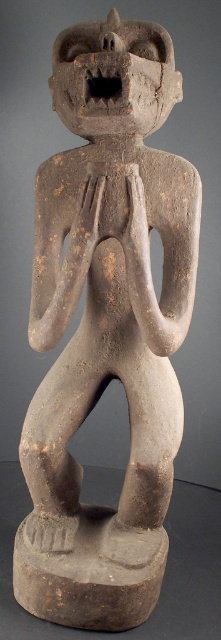
Question: Which point is closer to the camera?

Choices:
 (A) brown clay hands at center
 (B) brown clay hand at center

Answer: (A)

Question: Does brown clay hand at center have a greater width compared to brown clay hands at center?

Choices:
 (A) yes
 (B) no

Answer: (A)

Question: Considering the relative positions of brown clay hand at center and brown clay hands at center in the image provided, where is brown clay hand at center located with respect to brown clay hands at center?

Choices:
 (A) right
 (B) left

Answer: (B)

Question: Does brown clay hand at center appear under brown clay hands at center?

Choices:
 (A) no
 (B) yes

Answer: (A)